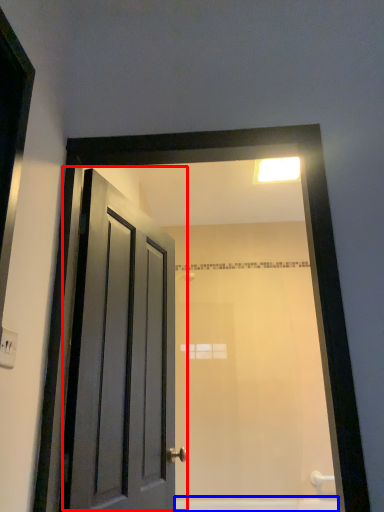
Question: Which of the following is the closest to the observer, door (highlighted by a red box) or bath (highlighted by a blue box)?

Choices:
 (A) door
 (B) bath

Answer: (A)